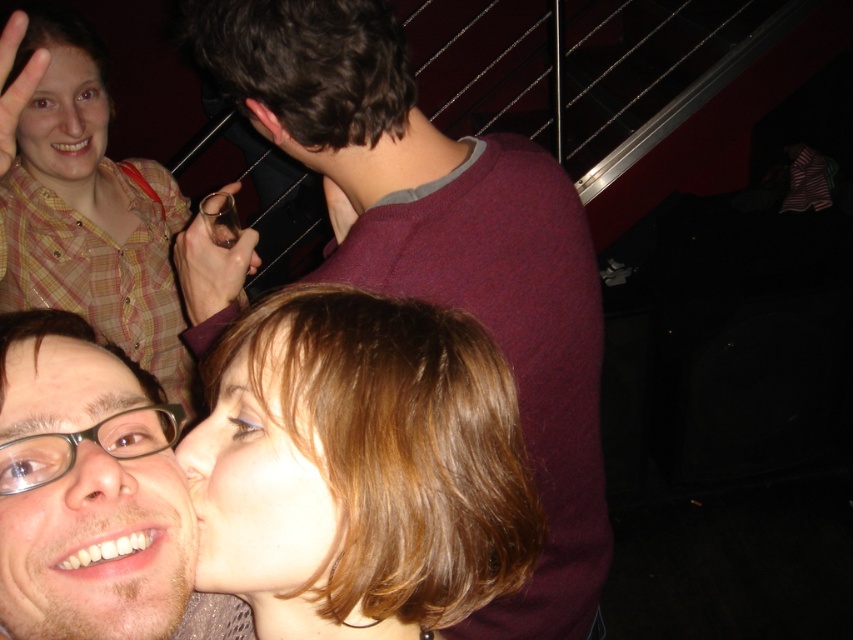
You are at a party and want to take a photo of the shiny brown hair at center and the matte yellow shirt at upper left. Which object should you focus on first to ensure both are in the frame?

You should focus on the shiny brown hair at center first because it is in front of the matte yellow shirt at upper left, so starting with the foreground object ensures both will be in the frame.

You are standing at the point labeled as point (390, 273) in the image and want to reach the entrance door located behind the staircase railing. The door is 1.2 meters away from your current position. Can you safely walk straight to the door without any obstacles?

The distance between point (390, 273) and the viewer is 95.39 centimeters. Since the door is 1.2 meters away, you would need to walk an additional 24.61 centimeters beyond your current position to reach the door. However, the description does not mention any obstacles between the point and the door, so assuming the path is clear, you can proceed safely.